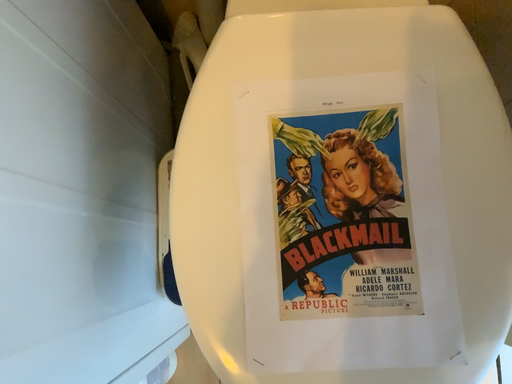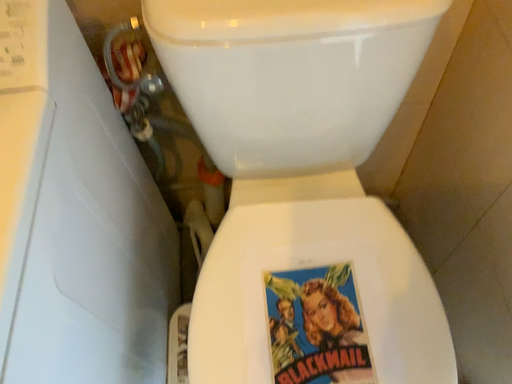
Question: How did the camera likely rotate when shooting the video?

Choices:
 (A) rotated downward
 (B) rotated upward

Answer: (B)